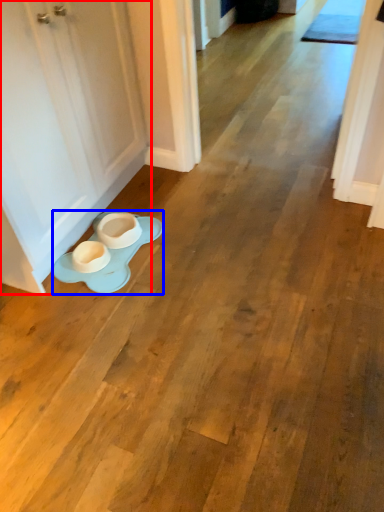
Question: Which object appears farthest to the camera in this image, door (highlighted by a red box) or saucer (highlighted by a blue box)?

Choices:
 (A) door
 (B) saucer

Answer: (B)